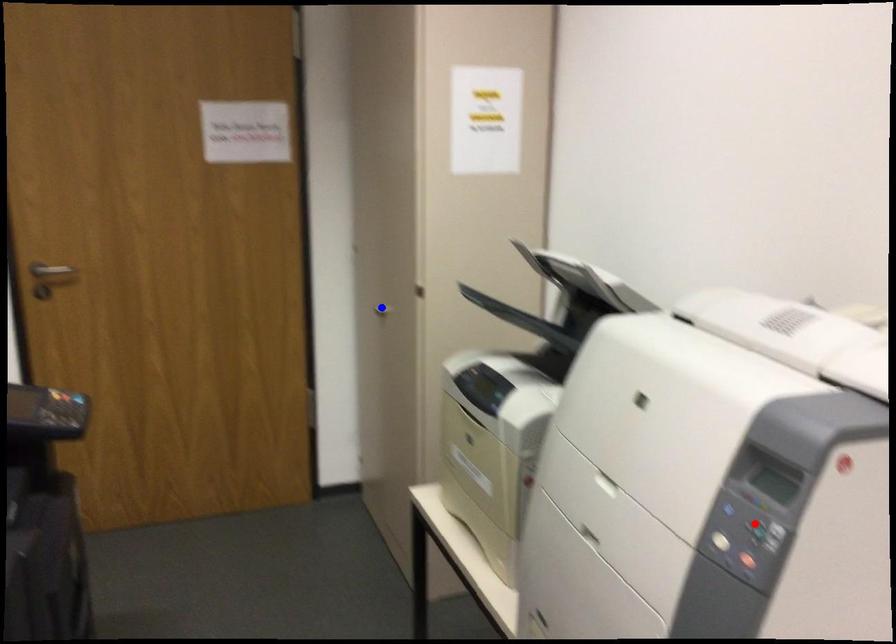
Question: Two points are marked on the image. Which point is closer to the camera?

Choices:
 (A) Blue point is closer.
 (B) Red point is closer.

Answer: (B)